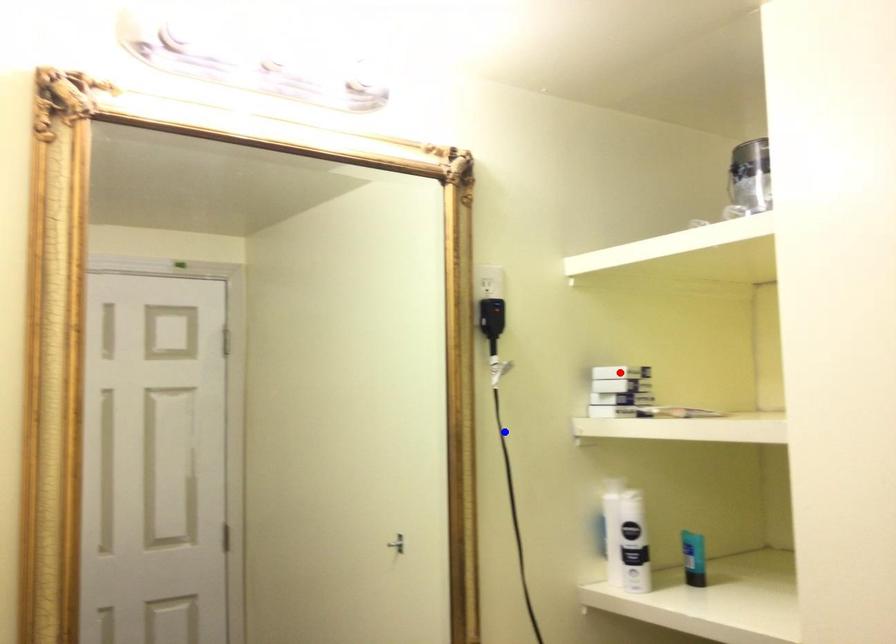
Question: Which of the two points in the image is closer to the camera?

Choices:
 (A) Blue point is closer.
 (B) Red point is closer.

Answer: (A)